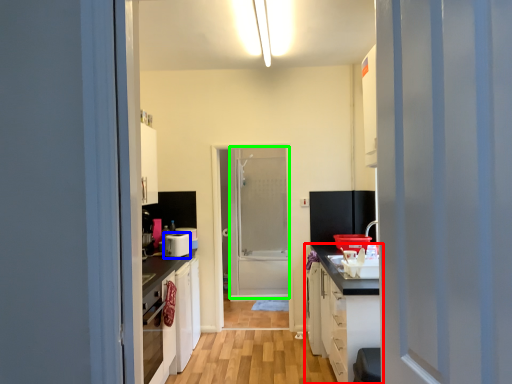
Question: Estimate the real-world distances between objects in this image. Which object is closer to cabinetry (highlighted by a red box), appliance (highlighted by a blue box) or screen door (highlighted by a green box)?

Choices:
 (A) appliance
 (B) screen door

Answer: (A)